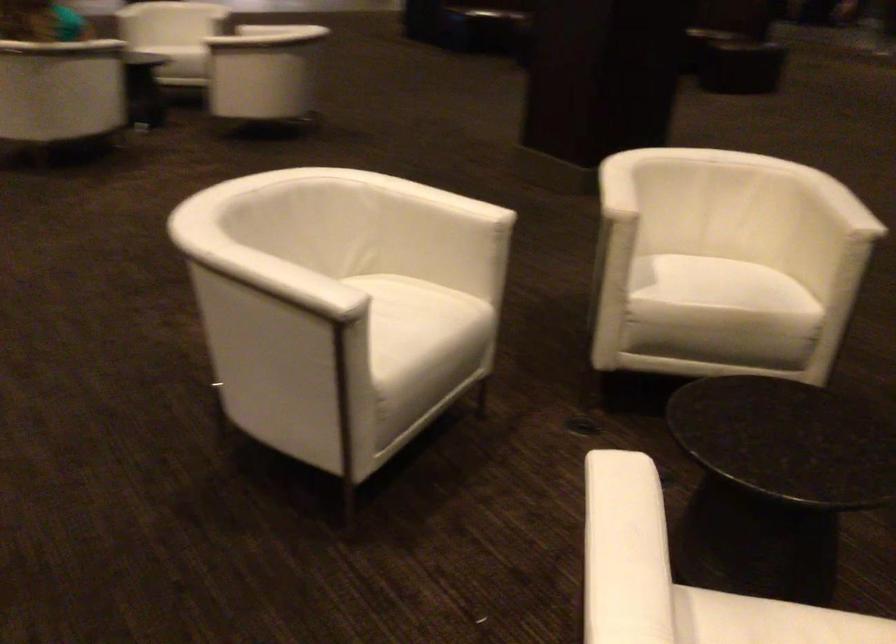
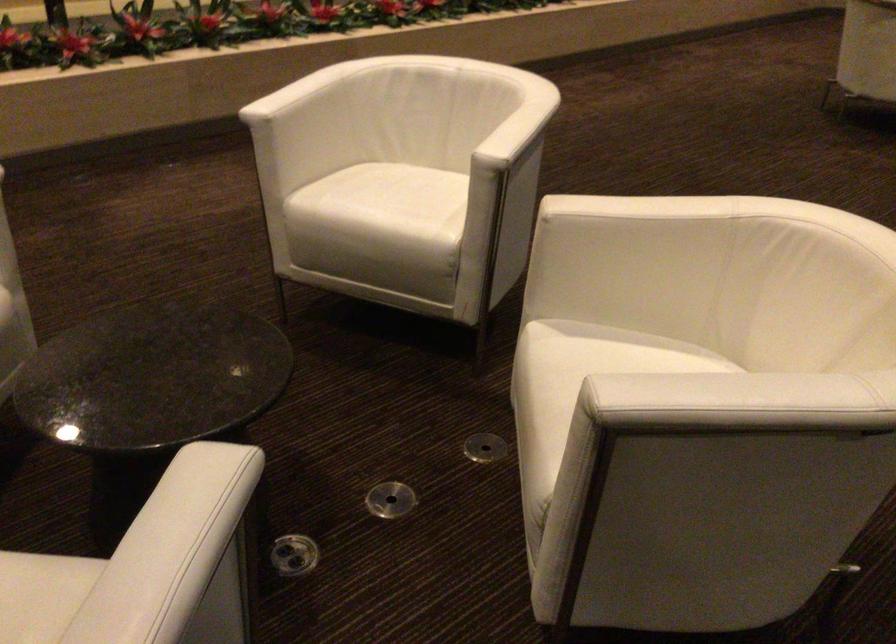
Find the pixel in the second image that matches point (806, 431) in the first image.

(152, 377)